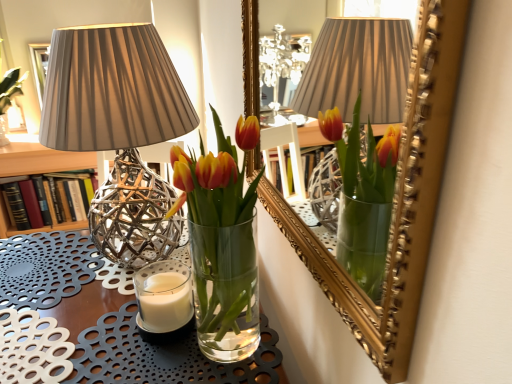
The image size is (512, 384). Find the location of `unoccupied region to the right of white wax candle at lower left`. unoccupied region to the right of white wax candle at lower left is located at coordinates (230, 342).